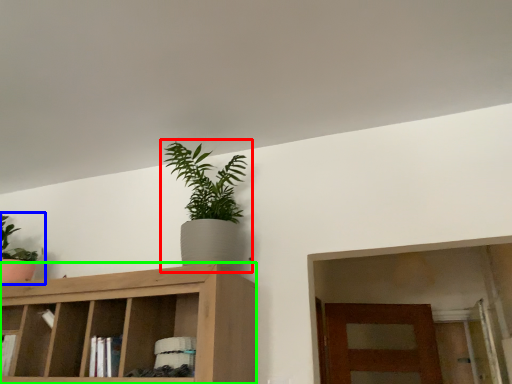
Question: Estimate the real-world distances between objects in this image. Which object is farther from houseplant (highlighted by a red box), houseplant (highlighted by a blue box) or cabinetry (highlighted by a green box)?

Choices:
 (A) houseplant
 (B) cabinetry

Answer: (A)